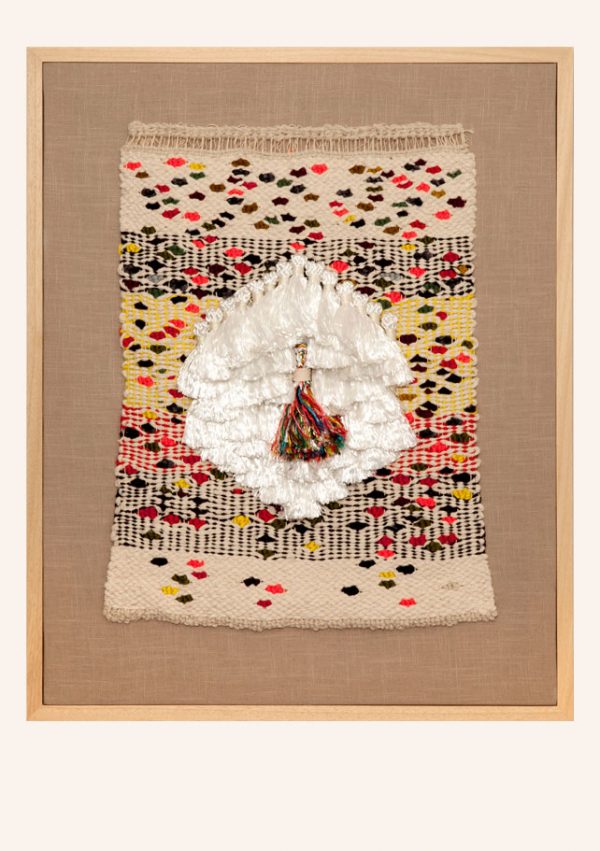
Identify the location of rug. (395, 311).